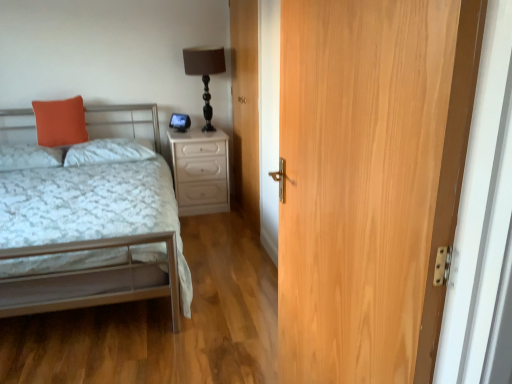
You are a GUI agent. You are given a task and a screenshot of the screen. Output one action in this format:
    pyautogui.click(x=<x>, y=<y>)
    Task: Click on the vacant area that lies in front of light brown wood door at center, the 2th door when ordered from right to left
    
    Given the screenshot: What is the action you would take?
    pyautogui.click(x=227, y=241)